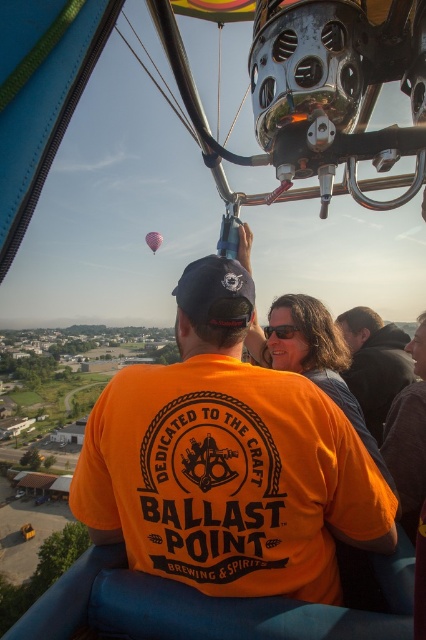
This screenshot has height=640, width=426. What do you see at coordinates (374, 364) in the screenshot? I see `black fuzzy jacket at upper right` at bounding box center [374, 364].

Locate an element on the screen. This screenshot has height=640, width=426. black fuzzy jacket at upper right is located at coordinates (374, 364).

Consider the image. Does orange cotton shirt at center appear on the right side of pink fabric balloon at upper center?

Correct, you'll find orange cotton shirt at center to the right of pink fabric balloon at upper center.

Find the location of `orange cotton shirt at center`. orange cotton shirt at center is located at coordinates (227, 461).

Does orange cotton shirt at center have a smaller size compared to black fuzzy jacket at upper right?

Actually, orange cotton shirt at center might be larger than black fuzzy jacket at upper right.

Between orange cotton shirt at center and black fuzzy jacket at upper right, which one has less height?

black fuzzy jacket at upper right is shorter.

Measure the distance between point (123, 509) and camera.

The distance of point (123, 509) from camera is 57.97 meters.

Where is `orange cotton shirt at center`? The height and width of the screenshot is (640, 426). orange cotton shirt at center is located at coordinates (227, 461).